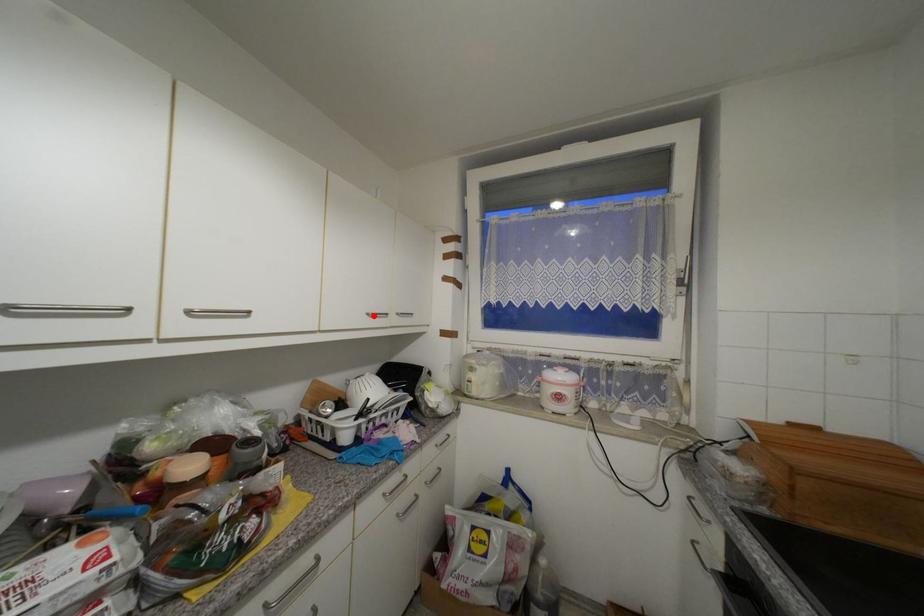
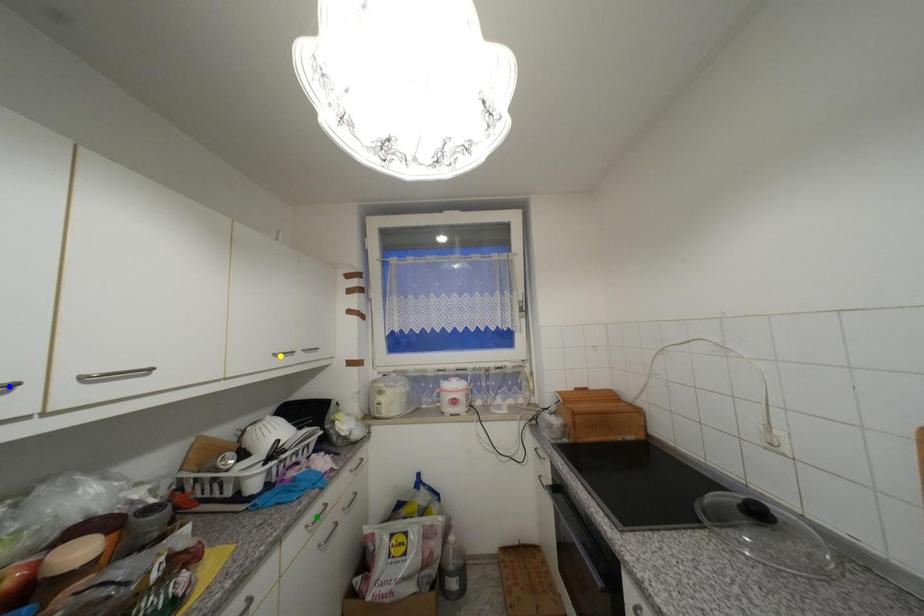
Question: I am providing you with two images of the same scene from different viewpoints. A red point is marked on the first image. You are given multiple points on the second image. Can you choose the point in image 2 that corresponds to the point in image 1?

Choices:
 (A) green point
 (B) yellow point
 (C) blue point

Answer: (B)